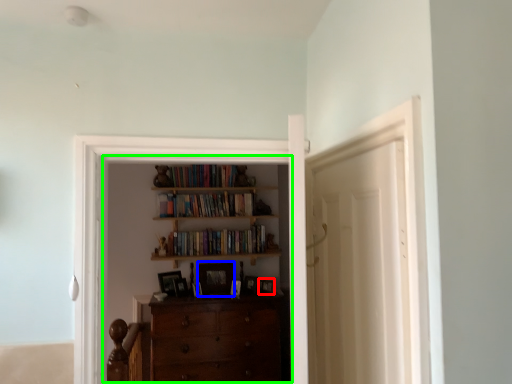
Question: Based on their relative distances, which object is nearer to picture frame (highlighted by a red box)? Choose from picture frame (highlighted by a blue box) and entertainment center (highlighted by a green box).

Choices:
 (A) picture frame
 (B) entertainment center

Answer: (A)